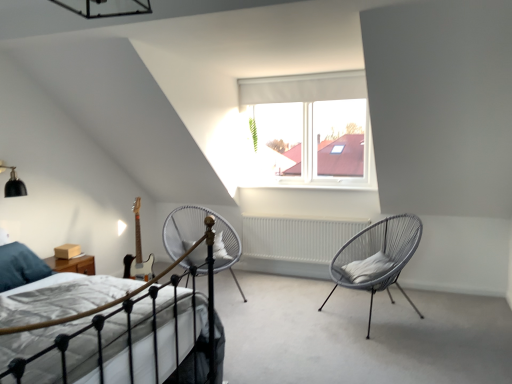
Image resolution: width=512 pixels, height=384 pixels. What do you see at coordinates (367, 268) in the screenshot? I see `white soft pillow at right` at bounding box center [367, 268].

Measure the distance between white fabric bed at lower left and camera.

white fabric bed at lower left is 1.38 meters away from camera.

This screenshot has height=384, width=512. What do you see at coordinates (297, 237) in the screenshot?
I see `white matte radiator at center` at bounding box center [297, 237].

What are the coordinates of `gray woven chair at right, which ranks as the first chair in right-to-left order` in the screenshot? It's located at (377, 257).

This screenshot has width=512, height=384. I want to click on black matte light fixture at upper left, so [13, 183].

Describe the element at coordinates (200, 237) in the screenshot. The width and height of the screenshot is (512, 384). I see `silver metallic chair at center, which is counted as the 1th chair, starting from the left` at that location.

Identify the location of white soft pillow at right. (367, 268).

Looking at this image, would you say silver metallic chair at center, placed as the second chair when sorted from right to left, is outside white matte radiator at center?

Absolutely, silver metallic chair at center, placed as the second chair when sorted from right to left, is external to white matte radiator at center.

From the image's perspective, is silver metallic chair at center, which is counted as the 1th chair, starting from the left, on white matte radiator at center?

Actually, silver metallic chair at center, which is counted as the 1th chair, starting from the left, appears below white matte radiator at center in the image.

Does silver metallic chair at center, placed as the second chair when sorted from right to left, turn towards white matte radiator at center?

No, silver metallic chair at center, placed as the second chair when sorted from right to left, does not turn towards white matte radiator at center.

Between black matte light fixture at upper left and white fabric bed at lower left, which one has more height?

With more height is white fabric bed at lower left.

Which object is positioned more to the left, black matte light fixture at upper left or white fabric bed at lower left?

Positioned to the left is black matte light fixture at upper left.

Based on the photo, is black matte light fixture at upper left turned away from white fabric bed at lower left?

No.

Considering the relative sizes of black matte light fixture at upper left and white fabric bed at lower left in the image provided, is black matte light fixture at upper left wider than white fabric bed at lower left?

In fact, black matte light fixture at upper left might be narrower than white fabric bed at lower left.

Between silver metallic chair at center, placed as the second chair when sorted from right to left, and white fabric bed at lower left, which one is positioned behind?

silver metallic chair at center, placed as the second chair when sorted from right to left, is further from the camera.

Are silver metallic chair at center, which is counted as the 1th chair, starting from the left, and white fabric bed at lower left making contact?

No, silver metallic chair at center, which is counted as the 1th chair, starting from the left, is not next to white fabric bed at lower left.

Would you say silver metallic chair at center, placed as the second chair when sorted from right to left, is inside or outside white fabric bed at lower left?

silver metallic chair at center, placed as the second chair when sorted from right to left, is not enclosed by white fabric bed at lower left.

Considering the relative positions of white fabric bed at lower left and silver metallic chair at center, which is counted as the 1th chair, starting from the left, in the image provided, is white fabric bed at lower left to the right of silver metallic chair at center, which is counted as the 1th chair, starting from the left, from the viewer's perspective?

No.

From the picture: Can you see white fabric bed at lower left touching silver metallic chair at center, which is counted as the 1th chair, starting from the left?

white fabric bed at lower left is not next to silver metallic chair at center, which is counted as the 1th chair, starting from the left, and they're not touching.

Based on the photo, can you confirm if white fabric bed at lower left is taller than silver metallic chair at center, which is counted as the 1th chair, starting from the left?

Incorrect, the height of white fabric bed at lower left is not larger of that of silver metallic chair at center, which is counted as the 1th chair, starting from the left.

Who is taller, gray woven chair at right, which ranks as the first chair in right-to-left order, or white matte radiator at center?

Standing taller between the two is gray woven chair at right, which ranks as the first chair in right-to-left order.

Does gray woven chair at right, which is counted as the 2th chair, starting from the left, appear on the left side of white matte radiator at center?

Incorrect, gray woven chair at right, which is counted as the 2th chair, starting from the left, is not on the left side of white matte radiator at center.

Does point (368, 272) lie in front of point (277, 245)?

Yes.

How many degrees apart are the facing directions of gray woven chair at right, which ranks as the first chair in right-to-left order, and white matte radiator at center?

38.6 degrees separate the facing orientations of gray woven chair at right, which ranks as the first chair in right-to-left order, and white matte radiator at center.

Is white matte radiator at center oriented away from white fabric bed at lower left?

That's not correct — white matte radiator at center is not looking away from white fabric bed at lower left.

From a real-world perspective, which is physically above, white matte radiator at center or white fabric bed at lower left?

From a 3D spatial view, white fabric bed at lower left is above.

Is white matte radiator at center positioned far away from white fabric bed at lower left?

Yes.

Looking at their sizes, would you say white matte radiator at center is wider or thinner than white fabric bed at lower left?

In the image, white matte radiator at center appears to be more narrow than white fabric bed at lower left.

Is white fabric curtain at upper center taller than white soft pillow at right?

Yes.

From a real-world perspective, is white fabric curtain at upper center positioned above or below white soft pillow at right?

From a real-world perspective, white fabric curtain at upper center is physically above white soft pillow at right.

Consider the image. From the image's perspective, is white fabric curtain at upper center over white soft pillow at right?

Yes, from the image's perspective, white fabric curtain at upper center is above white soft pillow at right.

Find the location of a particular element. Image resolution: width=512 pixels, height=384 pixels. radiator on the right of the silver metallic chair at center, placed as the second chair when sorted from right to left is located at coordinates (297, 237).

Image resolution: width=512 pixels, height=384 pixels. Identify the location of light fixture lying on the left of white fabric bed at lower left. (13, 183).

Considering their positions, is white soft pillow at right positioned further to white fabric bed at lower left than black matte light fixture at upper left?

white soft pillow at right is further to white fabric bed at lower left.

Looking at this image, which object lies further to the anchor point silver metallic chair at center, which is counted as the 1th chair, starting from the left, white matte radiator at center or white fabric bed at lower left?

white fabric bed at lower left lies further to silver metallic chair at center, which is counted as the 1th chair, starting from the left, than the other object.

When comparing their distances from gray woven chair at right, which is counted as the 2th chair, starting from the left, does white fabric curtain at upper center or white matte radiator at center seem further?

white fabric curtain at upper center lies further to gray woven chair at right, which is counted as the 2th chair, starting from the left, than the other object.

Which object lies nearer to the anchor point gray woven chair at right, which is counted as the 2th chair, starting from the left, white matte radiator at center or black matte light fixture at upper left?

white matte radiator at center is positioned closer to the anchor gray woven chair at right, which is counted as the 2th chair, starting from the left.

Estimate the real-world distances between objects in this image. Which object is further from white fabric bed at lower left, silver metallic chair at center, placed as the second chair when sorted from right to left, or black matte light fixture at upper left?

Among the two, black matte light fixture at upper left is located further to white fabric bed at lower left.

Estimate the real-world distances between objects in this image. Which object is closer to white soft pillow at right, white fabric bed at lower left or black matte light fixture at upper left?

white fabric bed at lower left is closer to white soft pillow at right.

Considering their positions, is white fabric bed at lower left positioned further to black matte light fixture at upper left than gray woven chair at right, which is counted as the 2th chair, starting from the left?

Among the two, gray woven chair at right, which is counted as the 2th chair, starting from the left, is located further to black matte light fixture at upper left.

Estimate the real-world distances between objects in this image. Which object is closer to white matte radiator at center, white soft pillow at right or silver metallic chair at center, placed as the second chair when sorted from right to left?

The object closer to white matte radiator at center is silver metallic chair at center, placed as the second chair when sorted from right to left.

At what (x,y) coordinates should I click in order to perform the action: click on pillow between white fabric bed at lower left and white fabric curtain at upper center from front to back. Please return your answer as a coordinate pair (x, y). Looking at the image, I should click on (367, 268).

In order to click on chair located between black matte light fixture at upper left and white fabric curtain at upper center in the left-right direction in this screenshot , I will do `click(200, 237)`.

Where is `curtain between black matte light fixture at upper left and white matte radiator at center from left to right`? This screenshot has height=384, width=512. curtain between black matte light fixture at upper left and white matte radiator at center from left to right is located at coordinates (302, 88).

You are a GUI agent. You are given a task and a screenshot of the screen. Output one action in this format:
    pyautogui.click(x=<x>, y=<y>)
    Task: Click on the radiator situated between black matte light fixture at upper left and gray woven chair at right, which ranks as the first chair in right-to-left order, from left to right
    The image size is (512, 384).
    Given the screenshot: What is the action you would take?
    pyautogui.click(x=297, y=237)